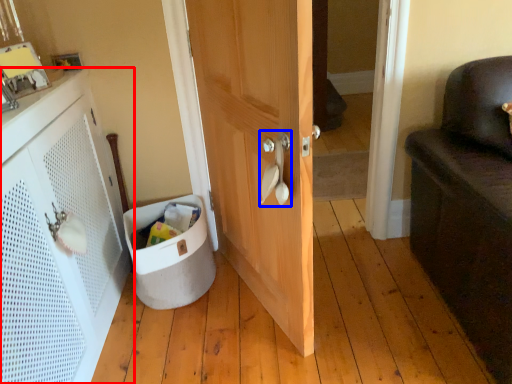
Question: Which object is closer to the camera taking this photo, cabinetry (highlighted by a red box) or door handle (highlighted by a blue box)?

Choices:
 (A) cabinetry
 (B) door handle

Answer: (A)